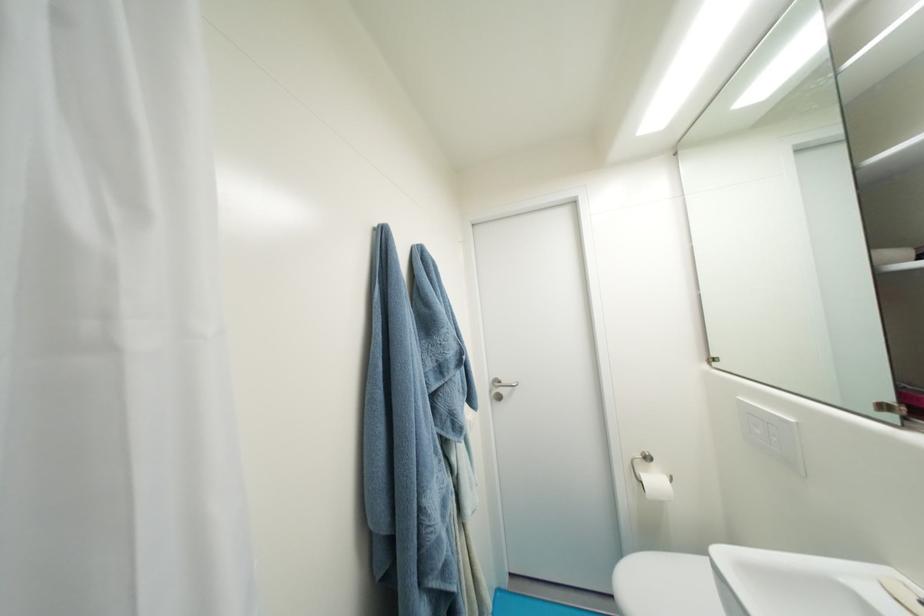
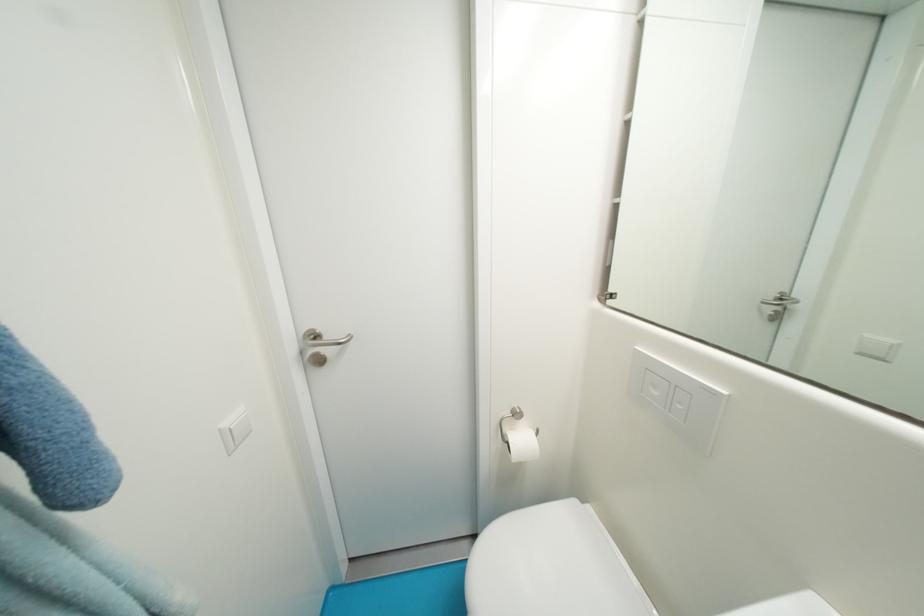
The images are taken continuously from a first-person perspective. In which direction is your viewpoint rotating?

The rotation direction of the camera is right-down.